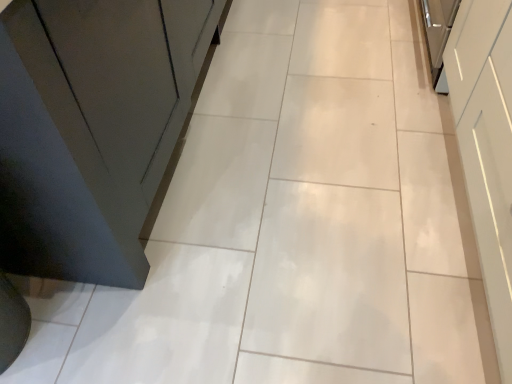
Question: Considering the positions of white glossy drawer at upper right and white glossy cabinet at right in the image, is white glossy drawer at upper right taller or shorter than white glossy cabinet at right?

Choices:
 (A) tall
 (B) short

Answer: (B)

Question: In terms of width, does white glossy drawer at upper right look wider or thinner when compared to white glossy cabinet at right?

Choices:
 (A) thin
 (B) wide

Answer: (A)

Question: Which is correct: white glossy drawer at upper right is inside white glossy cabinet at right, or outside of it?

Choices:
 (A) outside
 (B) inside

Answer: (A)

Question: Is white glossy cabinet at right to the left or to the right of white glossy drawer at upper right in the image?

Choices:
 (A) left
 (B) right

Answer: (A)

Question: Looking at their shapes, would you say white glossy cabinet at right is wider or thinner than white glossy drawer at upper right?

Choices:
 (A) thin
 (B) wide

Answer: (B)

Question: From the image's perspective, is white glossy cabinet at right positioned above or below white glossy drawer at upper right?

Choices:
 (A) above
 (B) below

Answer: (B)

Question: Looking at the image, does white glossy cabinet at right seem bigger or smaller compared to white glossy drawer at upper right?

Choices:
 (A) small
 (B) big

Answer: (B)